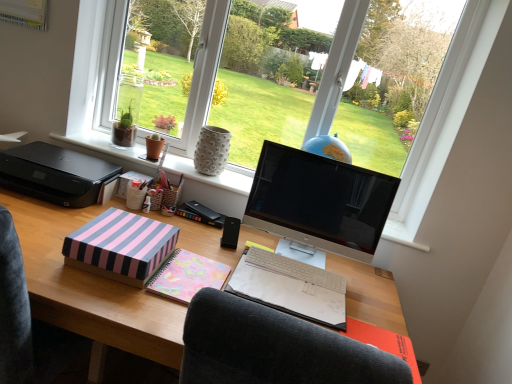
Question: Is white textured vase at center at the back of black plastic speaker at center?

Choices:
 (A) yes
 (B) no

Answer: (A)

Question: Is black plastic speaker at center at the right side of white textured vase at center?

Choices:
 (A) yes
 (B) no

Answer: (A)

Question: Does black plastic speaker at center appear on the left side of white textured vase at center?

Choices:
 (A) yes
 (B) no

Answer: (B)

Question: From a real-world perspective, does black plastic speaker at center stand above white textured vase at center?

Choices:
 (A) yes
 (B) no

Answer: (B)

Question: Considering the relative sizes of black plastic speaker at center and white textured vase at center in the image provided, is black plastic speaker at center smaller than white textured vase at center?

Choices:
 (A) no
 (B) yes

Answer: (B)

Question: From a real-world perspective, is black plastic speaker at center physically below white textured vase at center?

Choices:
 (A) yes
 (B) no

Answer: (A)

Question: Does pastel floral notebook at center have a lesser height compared to black plastic speaker at center?

Choices:
 (A) yes
 (B) no

Answer: (A)

Question: Does pastel floral notebook at center have a greater height compared to black plastic speaker at center?

Choices:
 (A) yes
 (B) no

Answer: (B)

Question: From a real-world perspective, does pastel floral notebook at center sit lower than black plastic speaker at center?

Choices:
 (A) yes
 (B) no

Answer: (A)

Question: Is pastel floral notebook at center directly adjacent to black plastic speaker at center?

Choices:
 (A) no
 (B) yes

Answer: (A)

Question: Is pastel floral notebook at center to the left of black plastic speaker at center from the viewer's perspective?

Choices:
 (A) no
 (B) yes

Answer: (A)

Question: Is pastel floral notebook at center aimed at black plastic speaker at center?

Choices:
 (A) yes
 (B) no

Answer: (B)

Question: Considering the relative positions of pastel floral notebook at center and black plastic printer at left in the image provided, is pastel floral notebook at center to the left of black plastic printer at left from the viewer's perspective?

Choices:
 (A) yes
 (B) no

Answer: (B)